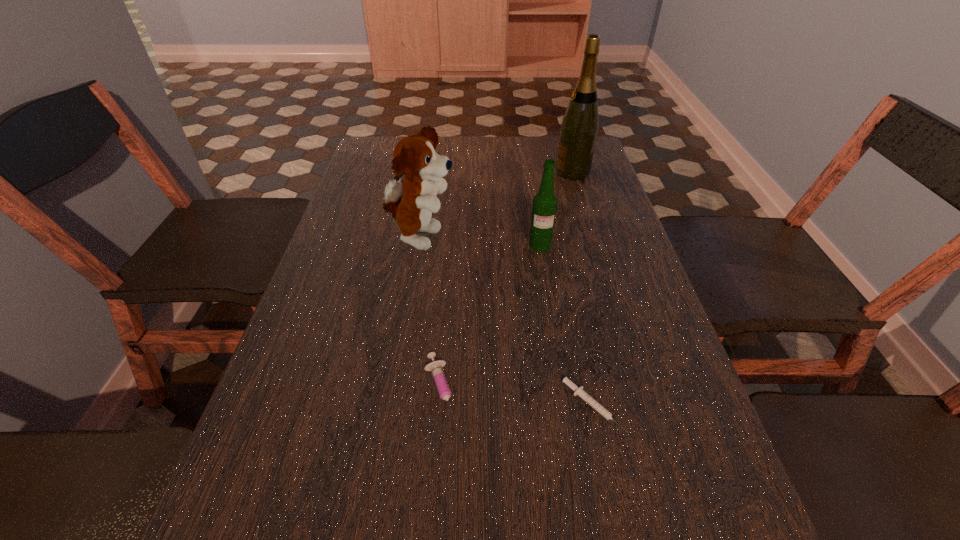
Image resolution: width=960 pixels, height=540 pixels. I want to click on vacant space located on the front-facing side of the tallest object, so click(468, 172).

I want to click on vacant space located 0.060m on the face of the fourth shortest object, so click(480, 239).

Image resolution: width=960 pixels, height=540 pixels. I want to click on vacant region located 0.380m on the label of the beer bottle, so click(563, 387).

The width and height of the screenshot is (960, 540). I want to click on free space located 0.390m on the right of the left syringe, so click(x=678, y=392).

In order to click on free point located 0.100m on the left of the right syringe in this screenshot , I will do `click(508, 406)`.

Locate an element on the screen. object that is at the far edge is located at coordinates (579, 128).

I want to click on object located in the left edge section of the desktop, so click(x=412, y=200).

At what (x,y) coordinates should I click in order to perform the action: click on wine bottle situated at the right edge. Please return your answer as a coordinate pair (x, y). This screenshot has height=540, width=960. Looking at the image, I should click on (579, 128).

Where is `syringe that is positioned at the right edge`? The image size is (960, 540). syringe that is positioned at the right edge is located at coordinates (579, 391).

This screenshot has width=960, height=540. What are the coordinates of `object positioned at the far right corner` in the screenshot? It's located at (579, 128).